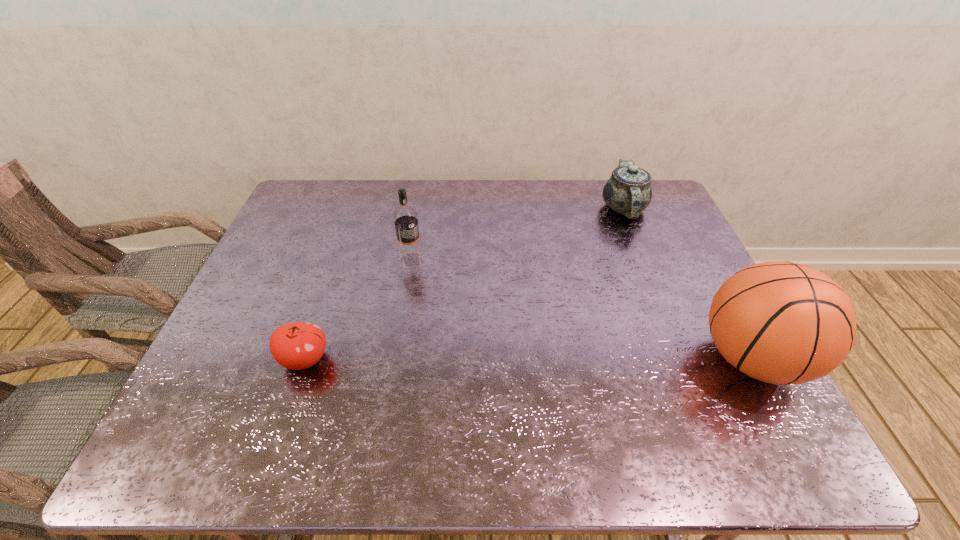
The image size is (960, 540). What are the coordinates of `free space located on the label of the vodka` in the screenshot? It's located at (471, 368).

Identify the location of vacant space located on the label of the vodka. This screenshot has height=540, width=960. (461, 349).

Identify the location of vacant space located 0.090m from the spout of the farthest object. (617, 246).

Where is `free location located from the spout of the farthest object`? Image resolution: width=960 pixels, height=540 pixels. free location located from the spout of the farthest object is located at coordinates (619, 240).

Find the location of a particular element. Image resolution: width=960 pixels, height=540 pixels. vacant region located 0.160m from the spout of the farthest object is located at coordinates (612, 260).

Where is `object that is at the far edge`? The image size is (960, 540). object that is at the far edge is located at coordinates [x=628, y=191].

You are a GUI agent. You are given a task and a screenshot of the screen. Output one action in this format:
    pyautogui.click(x=<x>, y=<y>)
    Task: Click on the apple situated at the near edge
    The width and height of the screenshot is (960, 540).
    Given the screenshot: What is the action you would take?
    pyautogui.click(x=299, y=345)

The height and width of the screenshot is (540, 960). Find the location of `basketball that is at the near edge`. basketball that is at the near edge is located at coordinates (780, 322).

Where is `basketball at the right edge`? The image size is (960, 540). basketball at the right edge is located at coordinates (780, 322).

I want to click on chinaware located at the right edge, so click(x=628, y=191).